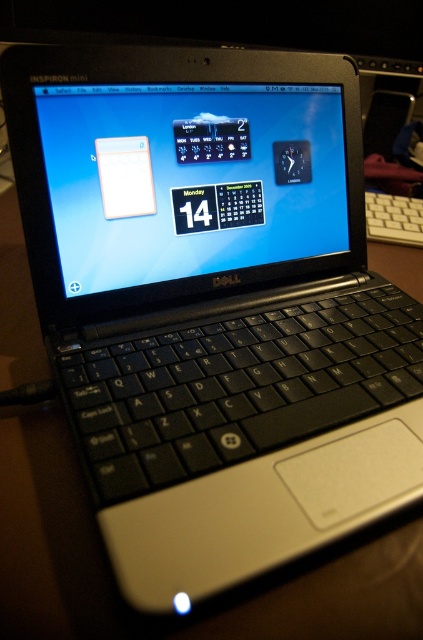
You are setting up a desk for a presentation and need to know if the matte plastic screen at center and the white plastic keyboard at right can fit side by side without overlapping. Based on their widths, can they fit if the desk has enough space?

The matte plastic screen at center is wider than the white plastic keyboard at right, so as long as the desk has sufficient space to accommodate both their widths side by side, they can fit without overlapping.

You are looking at the Dell Inspiron Mini laptop screen. There are two points on the screen. The first point is at coordinates point (239, 116) and the second point is at point (392, 224). Which point is closer to you?

Point (239, 116) is in front of point (392, 224), so the first point is closer to you.